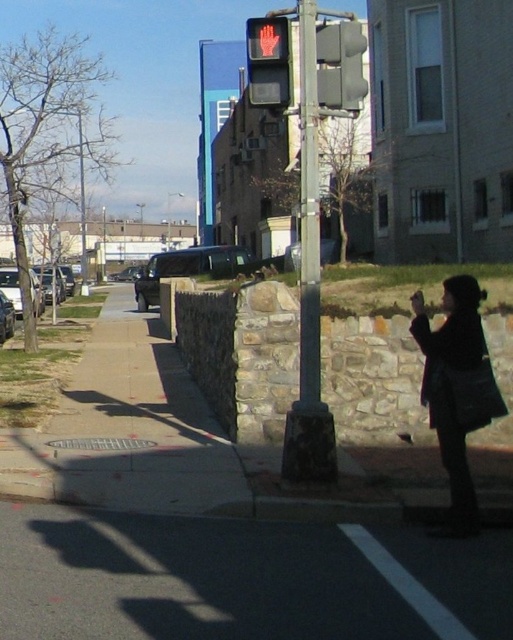
Question: Can you confirm if black matte coat at lower right is thinner than metallic gray pole at center?

Choices:
 (A) yes
 (B) no

Answer: (B)

Question: Which object is the closest to the gray matte traffic light at upper center?

Choices:
 (A) shiny black suv at center
 (B) metallic gray pole at center
 (C) metallic silver car at lower left

Answer: (B)

Question: Considering the real-world distances, which object is closest to the metallic gray pole at center?

Choices:
 (A) shiny black suv at center
 (B) metallic pole at center
 (C) dark gray metallic van at center-left
 (D) red matte pedestrian signal at upper center

Answer: (B)

Question: Which object is positioned farthest from the silver metallic sedan at left?

Choices:
 (A) metallic pole at center
 (B) shiny black suv at center
 (C) black matte coat at lower right

Answer: (A)

Question: Does metallic pole at center appear under gray matte traffic light at upper center?

Choices:
 (A) yes
 (B) no

Answer: (A)

Question: Can you confirm if gray matte traffic light at upper center is bigger than dark gray metallic van at center-left?

Choices:
 (A) no
 (B) yes

Answer: (A)